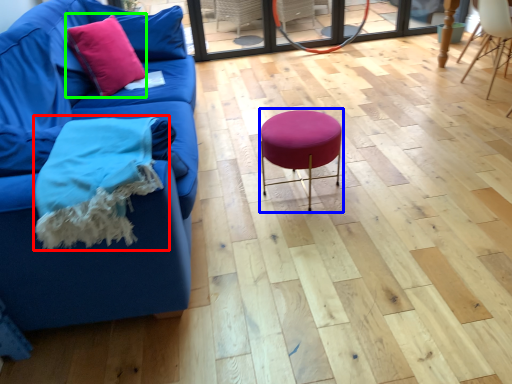
Question: Which is farther away from blanket (highlighted by a red box)? bar stool (highlighted by a blue box) or throw pillow (highlighted by a green box)?

Choices:
 (A) bar stool
 (B) throw pillow

Answer: (B)